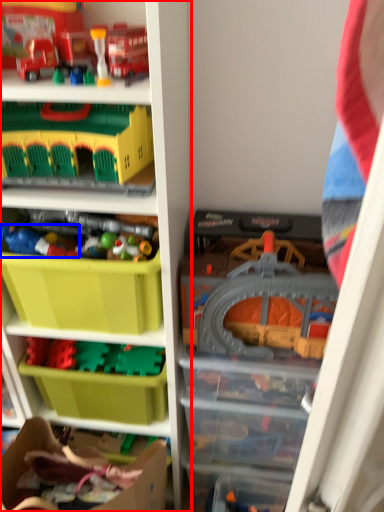
Question: Which object appears closest to the camera in this image, shelf (highlighted by a red box) or toy (highlighted by a blue box)?

Choices:
 (A) shelf
 (B) toy

Answer: (A)